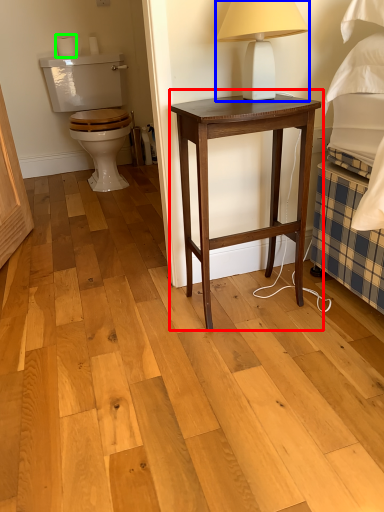
Question: Considering the real-world distances, which object is farthest from nightstand (highlighted by a red box)? table lamp (highlighted by a blue box) or toilet paper (highlighted by a green box)?

Choices:
 (A) table lamp
 (B) toilet paper

Answer: (B)